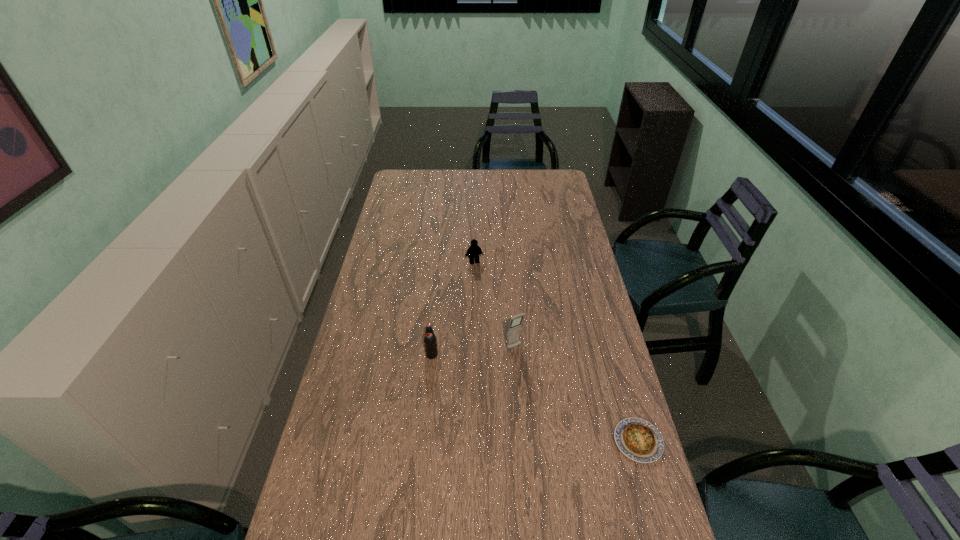
This screenshot has height=540, width=960. In order to click on vacant space that's between the second tallest object and the second shortest object in this screenshot , I will do 453,308.

The width and height of the screenshot is (960, 540). In order to click on the third closest object relative to the pop in this screenshot , I will do `click(639, 440)`.

Locate which object ranks third in proximity to the third object from left to right. Please provide its 2D coordinates. Your answer should be formatted as a tuple, i.e. [(x, y)], where the tuple contains the x and y coordinates of a point satisfying the conditions above.

[(474, 250)]

You are a GUI agent. You are given a task and a screenshot of the screen. Output one action in this format:
    pyautogui.click(x=<x>, y=<y>)
    Task: Click on the free space that satisfies the following two spatial constraints: 1. on the front label of the quiche; 2. on the right side of the leftmost object
    This screenshot has height=540, width=960.
    Given the screenshot: What is the action you would take?
    pyautogui.click(x=423, y=441)

This screenshot has height=540, width=960. Identify the location of vacant space that satisfies the following two spatial constraints: 1. on the front label of the nearest object; 2. on the right side of the leftmost object. (423, 441).